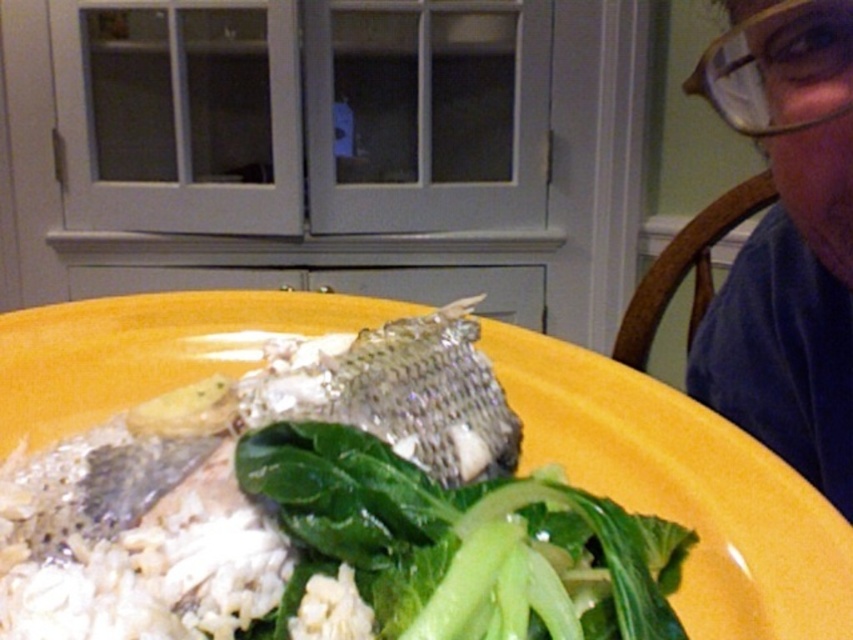
You are a chef arranging ingredients on a plate. You have a green leafy at center and a matte blue shirt at upper right. Which object is wider?

The green leafy at center is wider than the matte blue shirt at upper right according to the description.

You are a chef preparing a dish and need to adjust the placement of the green leafy at center and the matte blue shirt at upper right. Which object is closer to you when you look at the image?

The green leafy at center is closer to you because it is in front of the matte blue shirt at upper right.

From the picture: You are a delivery robot positioned at the center of the image. You need to deliver a package to the point marked at point (643, 509) and then to point (303, 449). However, you can only move forward and cannot reverse. Is it possible to complete this delivery route without reversing?

Since point (643, 509) is behind point (303, 449), the delivery robot can first move forward to point (303, 449) and then continue forward to reach point (643, 509) without needing to reverse.